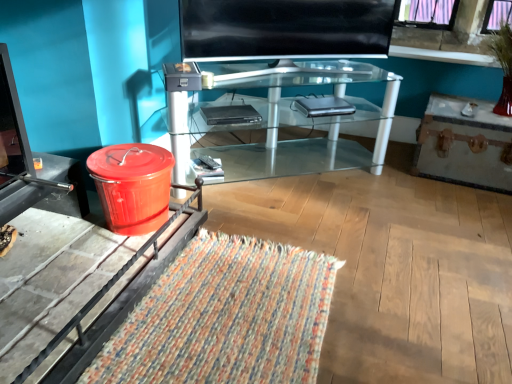
You are a GUI agent. You are given a task and a screenshot of the screen. Output one action in this format:
    pyautogui.click(x=<x>, y=<y>)
    Task: Click on the vacant space to the right of woven multicolored mat at lower left
    
    Given the screenshot: What is the action you would take?
    pyautogui.click(x=403, y=299)